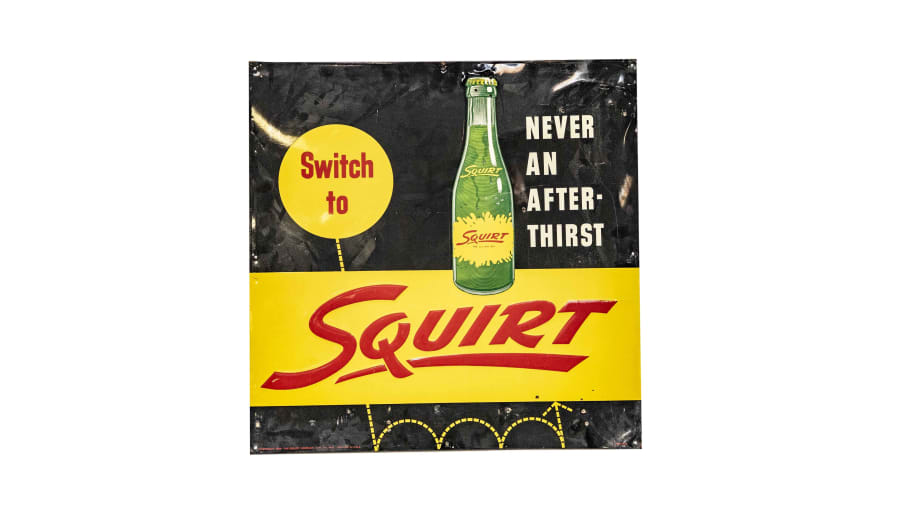
This screenshot has height=506, width=900. Identify the location of bottle cork. (488, 81).